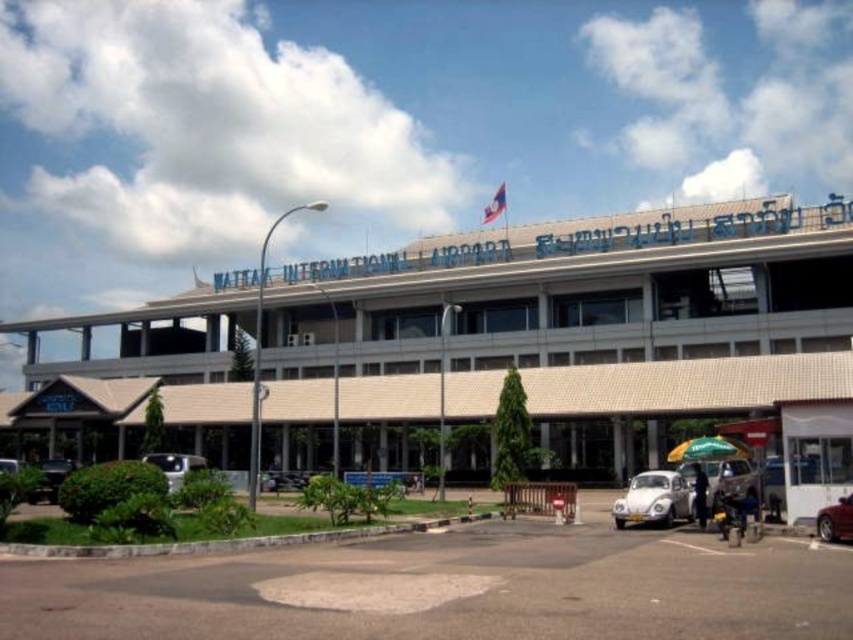
Between point (670, 508) and point (819, 538), which one is positioned in front?

Point (819, 538)

Looking at this image, between white matte car at lower center and shiny red car at lower right, which one has less height?

shiny red car at lower right is shorter.

In the scene shown: Who is more forward, (611, 508) or (833, 536)?

Point (833, 536) is in front.

Locate an element on the screen. white matte car at lower center is located at coordinates click(653, 499).

Based on the photo, does shiny red car at lower right appear over white matte car at lower left?

Yes.

Is shiny red car at lower right smaller than white matte car at lower left?

Correct, shiny red car at lower right occupies less space than white matte car at lower left.

Between point (836, 504) and point (180, 461), which one is positioned behind?

The point (180, 461) is more distant.

I want to click on shiny red car at lower right, so click(x=834, y=520).

Is beige textured building at lower left to the left of white matte car at lower left from the viewer's perspective?

Incorrect, beige textured building at lower left is not on the left side of white matte car at lower left.

Is beige textured building at lower left to the right of white matte car at lower left from the viewer's perspective?

Correct, you'll find beige textured building at lower left to the right of white matte car at lower left.

Where is `beige textured building at lower left`? beige textured building at lower left is located at coordinates (573, 323).